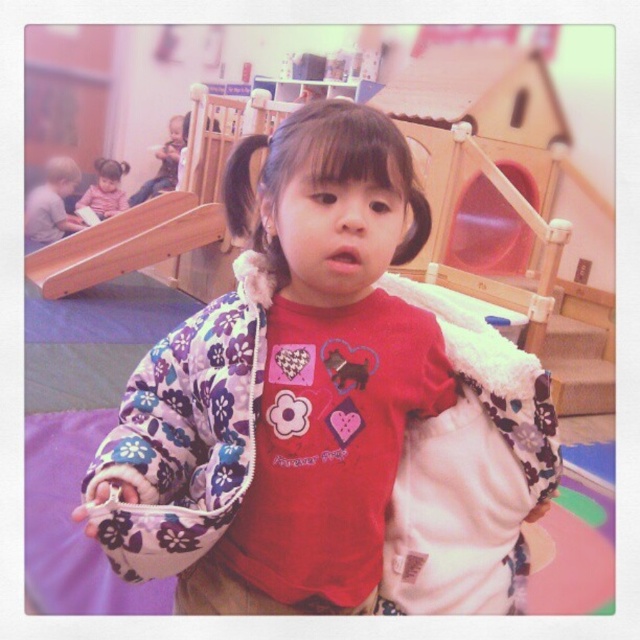
Question: Considering the relative positions of fluffy fleece jacket at center and black silky hair at center in the image provided, where is fluffy fleece jacket at center located with respect to black silky hair at center?

Choices:
 (A) above
 (B) below

Answer: (B)

Question: Does wooden playhouse at upper center appear over matte pink shirt at upper left?

Choices:
 (A) no
 (B) yes

Answer: (A)

Question: Which of the following is the farthest from the observer?

Choices:
 (A) tap(116, 168)
 (B) tap(248, 154)
 (C) tap(435, 74)
 (D) tap(49, 253)

Answer: (A)

Question: Which object is the closest to the black silky hair at center?

Choices:
 (A) wooden playhouse at upper center
 (B) fluffy fleece jacket at center
 (C) matte pink shirt at upper left
 (D) wooden at left

Answer: (B)

Question: Is fluffy fleece jacket at center positioned before wooden playhouse at upper center?

Choices:
 (A) no
 (B) yes

Answer: (B)

Question: Which object is closer to the camera taking this photo?

Choices:
 (A) matte pink shirt at upper left
 (B) black silky hair at center
 (C) wooden playhouse at upper center

Answer: (B)